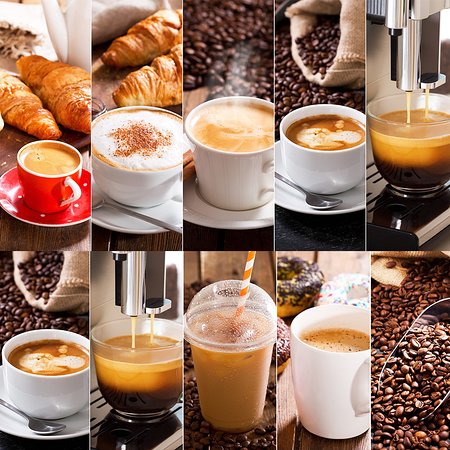
Find the location of a particular element. Image resolution: width=450 pixels, height=450 pixels. total amount of white cups is located at coordinates (37, 386), (312, 381), (314, 172), (233, 179), (138, 175).